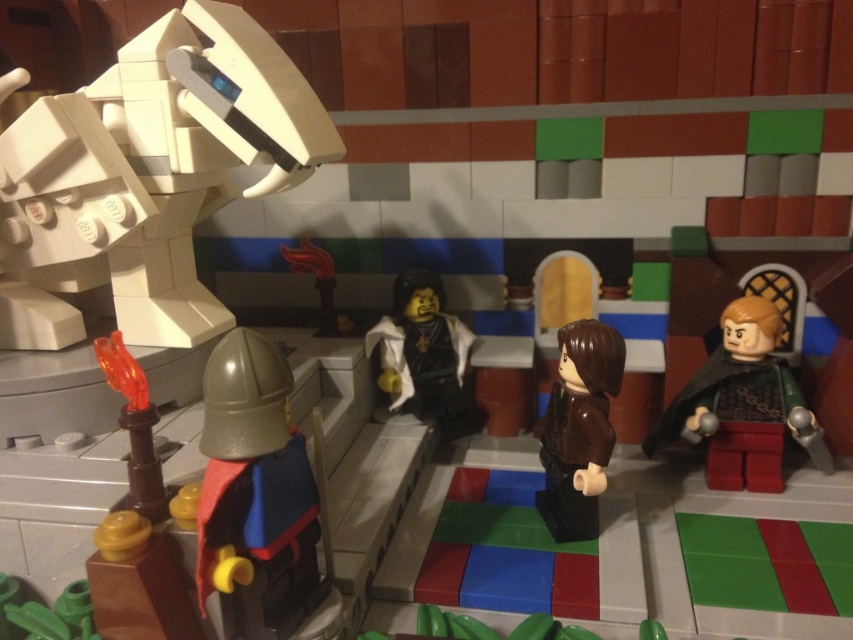
Question: Considering the relative positions of metallic silver helmet at lower left and green metallic armor at right in the image provided, where is metallic silver helmet at lower left located with respect to green metallic armor at right?

Choices:
 (A) below
 (B) above

Answer: (A)

Question: Is brown matte jacket at center to the right of matte black minifigure at center from the viewer's perspective?

Choices:
 (A) no
 (B) yes

Answer: (B)

Question: Estimate the real-world distances between objects in this image. Which object is farther from the metallic silver helmet at lower left?

Choices:
 (A) smooth red torch at center
 (B) green metallic armor at right
 (C) brown matte jacket at center
 (D) matte black minifigure at center

Answer: (B)

Question: Where is green metallic armor at right located in relation to brown matte jacket at center in the image?

Choices:
 (A) right
 (B) left

Answer: (A)

Question: Which of the following is the closest to the observer?

Choices:
 (A) (340, 320)
 (B) (225, 465)
 (C) (712, 387)
 (D) (578, 324)

Answer: (B)

Question: Which object is the closest to the metallic silver helmet at lower left?

Choices:
 (A) brown matte jacket at center
 (B) green metallic armor at right
 (C) matte black minifigure at center

Answer: (A)